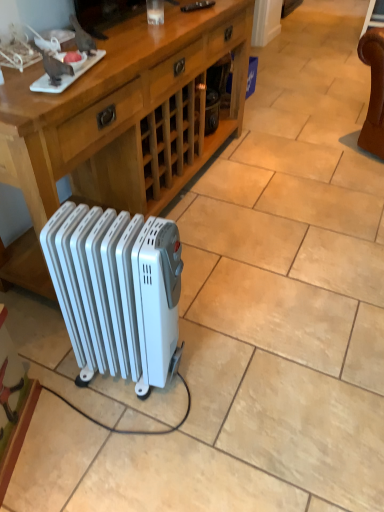
What are the coordinates of `vacant space in front of wooden desk at center` in the screenshot? It's located at (213, 347).